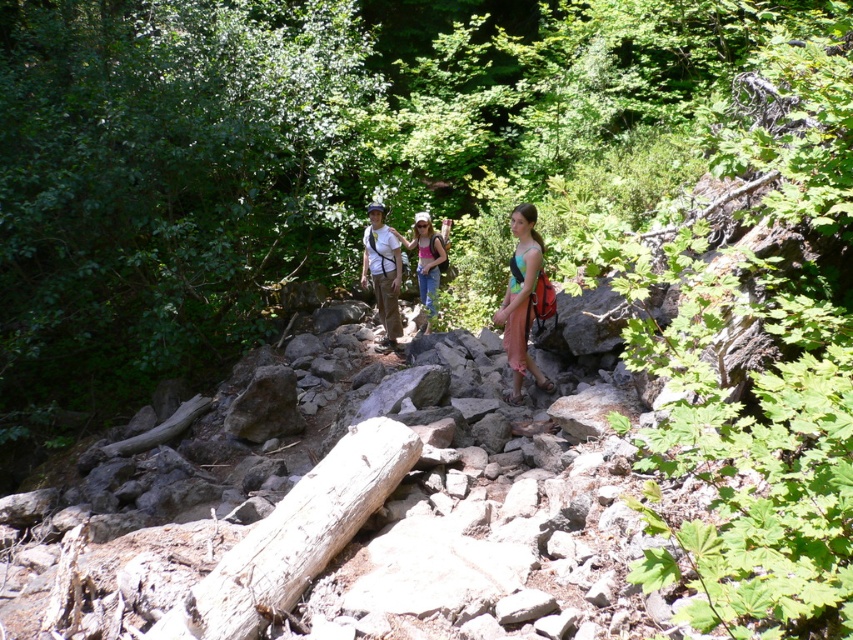
You are a photographer trying to capture a group photo of the hikers. You want to ensure that both the multicolored fabric dress at center and the matte pink tank top at center are in the frame. Given that your camera has a 6.5 feet focal length, will both subjects be within the camera frame?

The multicolored fabric dress at center and the matte pink tank top at center are 11.23 feet apart from each other. Since the camera has a 6.5 feet focal length, which is shorter than the distance between them, the two subjects will not both fit within the camera frame.

You are a photographer trying to capture the hikers in the image. You want to focus on the multicolored fabric dress at center and the matte pink tank top at center. Which clothing item should you adjust your camera to focus on first if you want to capture the one closer to the front?

The multicolored fabric dress at center is positioned under the matte pink tank top at center, so the matte pink tank top at center is closer to the front and should be focused on first.

You are a photographer trying to capture the hikers in the scene. You want to ensure that the multicolored fabric dress at center and the matte pink tank top at center are both visible in your shot. Given their height difference, which one might you need to adjust your camera angle to focus on to ensure both are in frame?

The multicolored fabric dress at center is taller than the matte pink tank top at center. To ensure both are visible, you might need to lower your camera angle slightly to include the shorter matte pink tank top at center while still capturing the taller multicolored fabric dress at center.